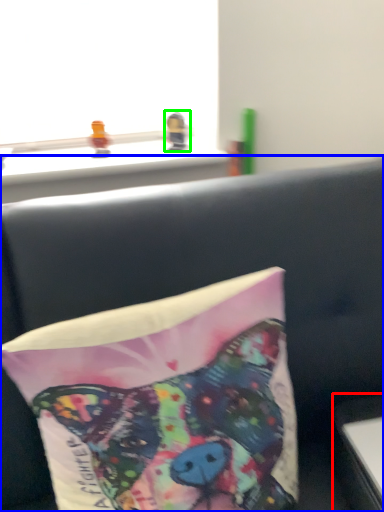
Question: Which is farther away from table (highlighted by a red box)? furniture (highlighted by a blue box) or toy (highlighted by a green box)?

Choices:
 (A) furniture
 (B) toy

Answer: (B)